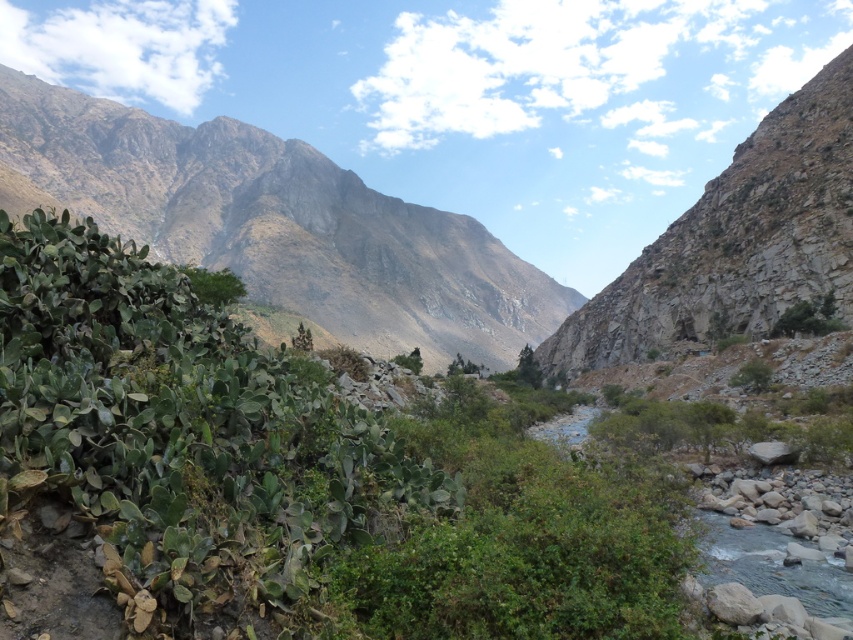
Who is more distant from viewer, (279, 250) or (708, 276)?

The point (279, 250) is behind.

Identify the location of gray rocky mountain at upper center. This screenshot has width=853, height=640. (281, 225).

Locate an element on the screen. The height and width of the screenshot is (640, 853). gray rocky mountain at upper center is located at coordinates (281, 225).